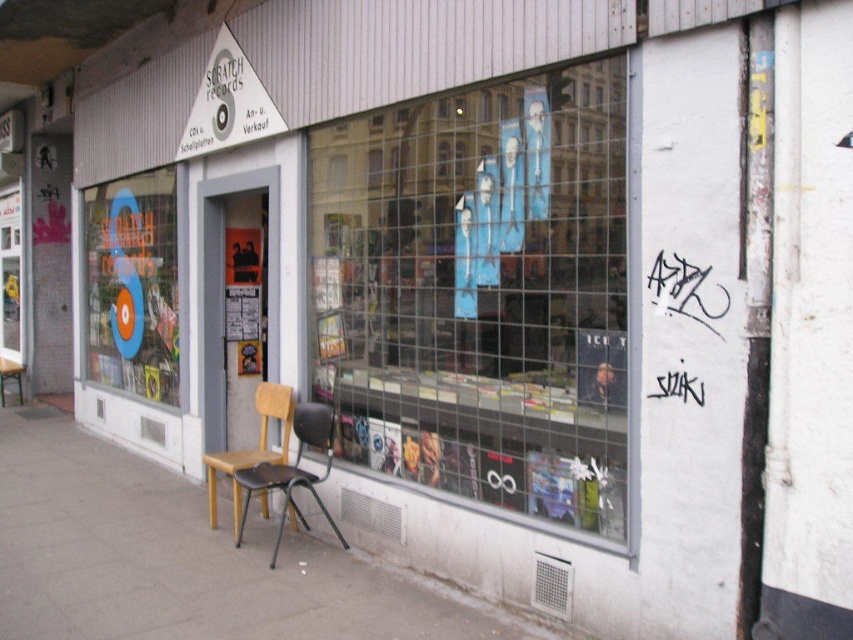
Which is more to the right, transparent glass window at center or black plastic chair at center?

transparent glass window at center is more to the right.

Locate an element on the screen. Image resolution: width=853 pixels, height=640 pixels. transparent glass window at center is located at coordinates (480, 291).

Does blue glass window at left have a larger size compared to black plastic chair at center?

Yes, blue glass window at left is bigger than black plastic chair at center.

Which is above, blue glass window at left or black plastic chair at center?

blue glass window at left is above.

Which is in front, point (144, 328) or point (283, 490)?

Point (283, 490) is in front.

Where is `blue glass window at left`? The width and height of the screenshot is (853, 640). blue glass window at left is located at coordinates (132, 285).

Is black plastic chair at center bigger than wooden seat at center?

Correct, black plastic chair at center is larger in size than wooden seat at center.

Can you confirm if black plastic chair at center is positioned to the left of wooden seat at center?

In fact, black plastic chair at center is to the right of wooden seat at center.

Which is in front, point (312, 444) or point (268, 449)?

Point (312, 444) is more forward.

The width and height of the screenshot is (853, 640). In order to click on black plastic chair at center in this screenshot , I will do pyautogui.click(x=292, y=472).